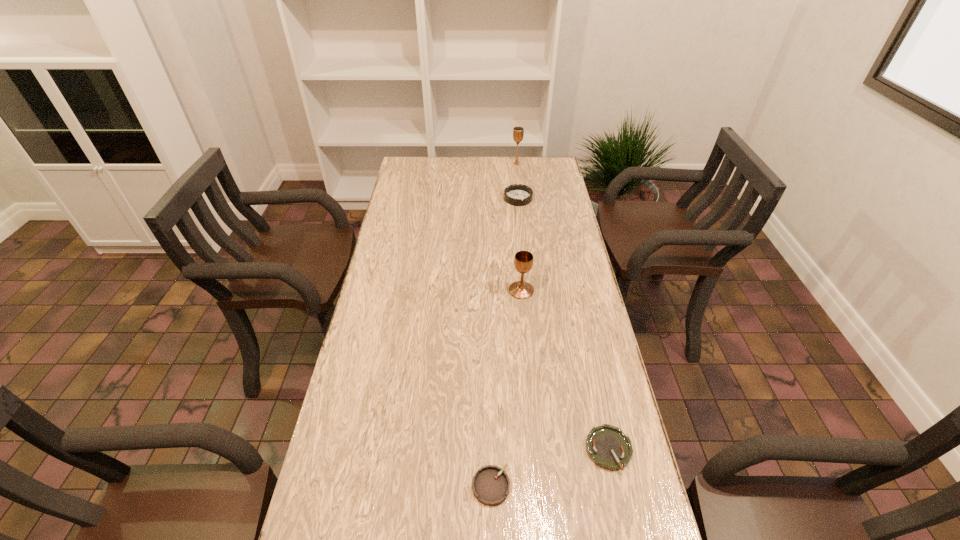
The image size is (960, 540). Identify the location of vacant space located on the left of the shorter chalice. (400, 291).

Where is `free region located 0.380m on the left of the third tallest object`? free region located 0.380m on the left of the third tallest object is located at coordinates (414, 199).

Find the location of a particular element. vacant point located 0.080m on the back of the leftmost ashtray is located at coordinates (490, 435).

Locate an element on the screen. This screenshot has height=540, width=960. vacant area situated on the left of the rightmost ashtray is located at coordinates (549, 449).

Locate an element on the screen. The image size is (960, 540). object present at the far edge is located at coordinates (518, 132).

Locate an element on the screen. This screenshot has height=540, width=960. free space at the left edge of the desktop is located at coordinates (394, 404).

Identify the location of vacant space at the right edge of the desktop. (575, 491).

In the image, there is a desktop. Where is `vacant space at the far left corner`? The height and width of the screenshot is (540, 960). vacant space at the far left corner is located at coordinates (427, 168).

This screenshot has width=960, height=540. Identify the location of free point at the far right corner. (536, 180).

Identify the location of vacant region between the rightmost object and the leftmost ashtray. The height and width of the screenshot is (540, 960). (550, 468).